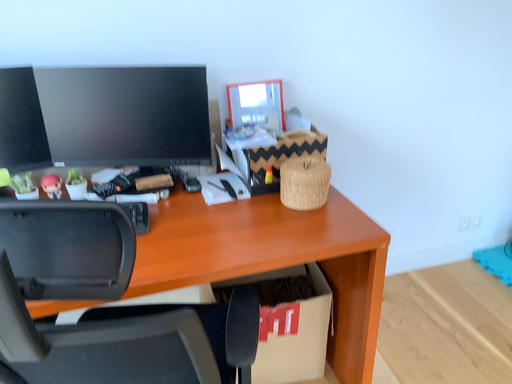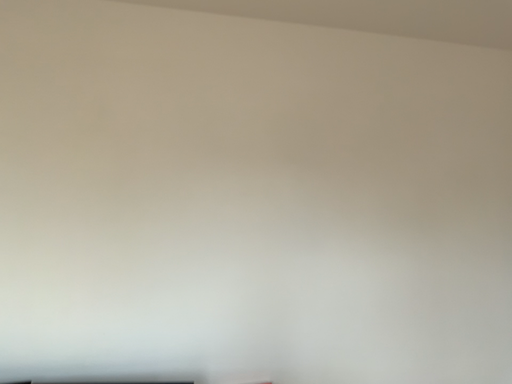
Question: How did the camera likely rotate when shooting the video?

Choices:
 (A) rotated downward
 (B) rotated upward

Answer: (B)